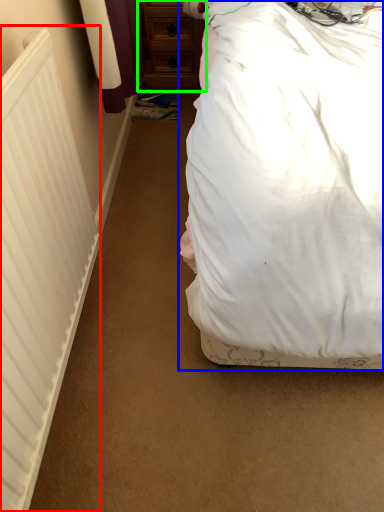
Question: Which object is the farthest from radiator (highlighted by a red box)? Choose among these: bed (highlighted by a blue box) or chest of drawers (highlighted by a green box).

Choices:
 (A) bed
 (B) chest of drawers

Answer: (B)